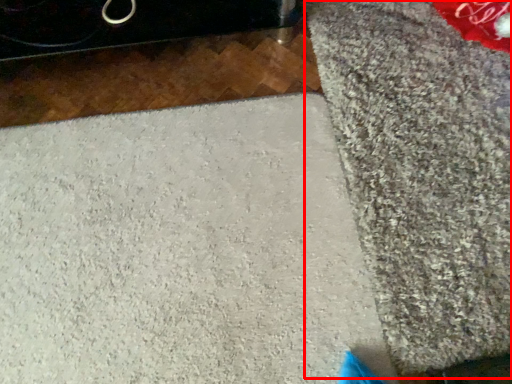
Question: From the image's perspective, where is mat (annotated by the red box) located in relation to concrete in the image?

Choices:
 (A) above
 (B) below

Answer: (A)